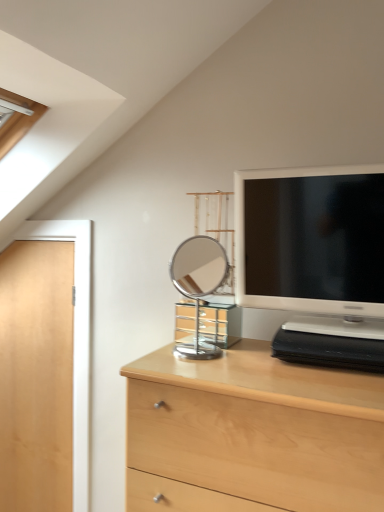
Identify the location of unoccupied region to the right of polished chrome mirror at center. This screenshot has height=512, width=384. click(x=254, y=362).